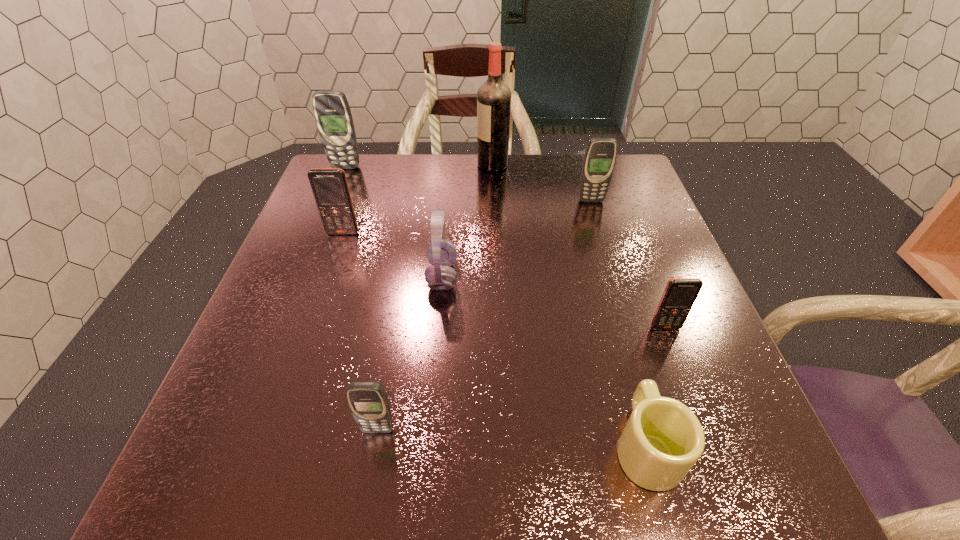
Locate an element on the screen. The width and height of the screenshot is (960, 540). object present at the far left corner is located at coordinates (332, 112).

Identify the location of object that is at the far right corner. (600, 156).

Find the location of a particular element. object that is at the near right corner is located at coordinates (662, 440).

Where is `blank space at the far edge of the desktop`? blank space at the far edge of the desktop is located at coordinates (485, 192).

At what (x,y) coordinates should I click in order to perform the action: click on free location at the near edge of the desktop. Please return your answer as a coordinate pair (x, y). Looking at the image, I should click on (380, 499).

Identify the location of vacant space at the left edge. The image size is (960, 540). (316, 379).

In the image, there is a desktop. Where is `free space at the right edge`? free space at the right edge is located at coordinates (726, 400).

Find the location of `free location at the far left corner`. free location at the far left corner is located at coordinates (368, 161).

Locate an element on the screen. blank space at the far right corner is located at coordinates (578, 166).

This screenshot has width=960, height=540. Identify the location of free space between the biggest gray cellular telephone and the fifth farthest object. (394, 222).